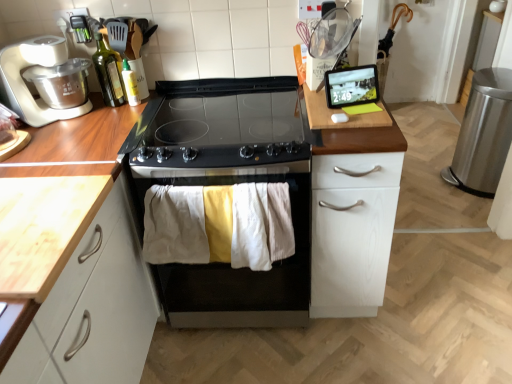
Identify the location of black glass cooktop at center. This screenshot has width=512, height=384. (219, 129).

Where is `white matte food processor at left`? This screenshot has height=384, width=512. white matte food processor at left is located at coordinates (26, 85).

What are the coordinates of `translucent plastic bottle at upper left, marked as the 2th bottle in a left-to-right arrangement` in the screenshot? It's located at (130, 84).

Can you confirm if translucent plastic bottle at upper left, marked as the 2th bottle in a left-to-right arrangement, is positioned to the left of matte black tablet at upper right?

Yes, translucent plastic bottle at upper left, marked as the 2th bottle in a left-to-right arrangement, is to the left of matte black tablet at upper right.

At what (x,y) coordinates should I click in order to perform the action: click on bottle that is the 2nd one when counting backward from the matte black tablet at upper right. Please return your answer as a coordinate pair (x, y). This screenshot has width=512, height=384. Looking at the image, I should click on (130, 84).

Is translucent plastic bottle at upper left, which is the first bottle from right to left, facing towards matte black tablet at upper right?

No, translucent plastic bottle at upper left, which is the first bottle from right to left, does not turn towards matte black tablet at upper right.

Between translucent plastic bottle at upper left, which is the first bottle from right to left, and matte black tablet at upper right, which one is positioned behind?

translucent plastic bottle at upper left, which is the first bottle from right to left, is further away from the camera.

From a real-world perspective, does white matte food processor at left sit lower than light wood countertop at left?

No, from a real-world perspective, white matte food processor at left is not beneath light wood countertop at left.

Consider the image. Is white matte food processor at left looking in the opposite direction of light wood countertop at left?

No, white matte food processor at left is not facing the opposite direction of light wood countertop at left.

Can we say white matte food processor at left lies outside light wood countertop at left?

Yes.

From the picture: Could translucent plastic bottle at upper left, marked as the 2th bottle in a left-to-right arrangement, be considered to be inside white matte food processor at left?

No, translucent plastic bottle at upper left, marked as the 2th bottle in a left-to-right arrangement, is not a part of white matte food processor at left.

Is point (29, 39) farther from camera compared to point (123, 60)?

That is True.

From a real-world perspective, which is physically below, white matte food processor at left or translucent plastic bottle at upper left, marked as the 2th bottle in a left-to-right arrangement?

translucent plastic bottle at upper left, marked as the 2th bottle in a left-to-right arrangement.

In terms of height, does white matte food processor at left look taller or shorter compared to translucent plastic bottle at upper left, which is the first bottle from right to left?

In the image, white matte food processor at left appears to be taller than translucent plastic bottle at upper left, which is the first bottle from right to left.

From the image's perspective, relative to green glass bottle at upper left, the 2th bottle positioned from the right, is black stainless steel oven at center above or below?

black stainless steel oven at center is situated lower than green glass bottle at upper left, the 2th bottle positioned from the right, in the image.

Is black stainless steel oven at center positioned behind green glass bottle at upper left, the 1th bottle in the left-to-right sequence?

No, black stainless steel oven at center is in front of green glass bottle at upper left, the 1th bottle in the left-to-right sequence.

Looking at this image, can you confirm if black stainless steel oven at center is shorter than green glass bottle at upper left, the 2th bottle positioned from the right?

In fact, black stainless steel oven at center may be taller than green glass bottle at upper left, the 2th bottle positioned from the right.

Which object is positioned more to the left, black stainless steel oven at center or green glass bottle at upper left, the 2th bottle positioned from the right?

green glass bottle at upper left, the 2th bottle positioned from the right.

Considering the relative sizes of white matte food processor at left and green glass bottle at upper left, the 1th bottle in the left-to-right sequence, in the image provided, is white matte food processor at left shorter than green glass bottle at upper left, the 1th bottle in the left-to-right sequence,?

Correct, white matte food processor at left is not as tall as green glass bottle at upper left, the 1th bottle in the left-to-right sequence.

From the picture: Considering the positions of objects white matte food processor at left and green glass bottle at upper left, the 2th bottle positioned from the right, in the image provided, who is behind, white matte food processor at left or green glass bottle at upper left, the 2th bottle positioned from the right,?

green glass bottle at upper left, the 2th bottle positioned from the right, is more distant.

Considering the relative positions of white matte food processor at left and green glass bottle at upper left, the 1th bottle in the left-to-right sequence, in the image provided, is white matte food processor at left to the left or to the right of green glass bottle at upper left, the 1th bottle in the left-to-right sequence,?

In the image, white matte food processor at left appears on the left side of green glass bottle at upper left, the 1th bottle in the left-to-right sequence.

What's the angular difference between white matte food processor at left and green glass bottle at upper left, the 1th bottle in the left-to-right sequence,'s facing directions?

white matte food processor at left and green glass bottle at upper left, the 1th bottle in the left-to-right sequence, are facing 81.2 degrees away from each other.

Is white matte cabinet at right next to black stainless steel oven at center and touching it?

No, white matte cabinet at right is not beside black stainless steel oven at center.

Can you confirm if white matte cabinet at right is thinner than black stainless steel oven at center?

Correct, the width of white matte cabinet at right is less than that of black stainless steel oven at center.

From a real-world perspective, is white matte cabinet at right over black stainless steel oven at center?

Yes, from a real-world perspective, white matte cabinet at right is above black stainless steel oven at center.

Which object is positioned more to the left, matte black tablet at upper right or translucent plastic bottle at upper left, marked as the 2th bottle in a left-to-right arrangement?

From the viewer's perspective, translucent plastic bottle at upper left, marked as the 2th bottle in a left-to-right arrangement, appears more on the left side.

You are a GUI agent. You are given a task and a screenshot of the screen. Output one action in this format:
    pyautogui.click(x=<x>, y=<y>)
    Task: Click on the 2nd bottle behind when counting from the matte black tablet at upper right
    The height and width of the screenshot is (384, 512).
    Given the screenshot: What is the action you would take?
    pyautogui.click(x=130, y=84)

Considering the points (362, 85) and (137, 98), which point is in front, point (362, 85) or point (137, 98)?

Point (362, 85)

Which of these two, matte black tablet at upper right or translucent plastic bottle at upper left, which is the first bottle from right to left, is bigger?

matte black tablet at upper right is bigger.

What are the coordinates of `appliance below the translucent plastic bottle at upper left, marked as the 2th bottle in a left-to-right arrangement (from the image's perspective)` in the screenshot? It's located at (351, 86).

You are a GUI agent. You are given a task and a screenshot of the screen. Output one action in this format:
    pyautogui.click(x=<x>, y=<y>)
    Task: Click on the countertop lying in front of the white matte food processor at left
    
    Given the screenshot: What is the action you would take?
    pyautogui.click(x=42, y=228)

Consider the image. Based on their spatial positions, is light wood countertop at left or matte black tablet at upper right closer to white matte cabinet at right?

matte black tablet at upper right.

Considering their positions, is green glass bottle at upper left, the 1th bottle in the left-to-right sequence, positioned further to black glass cooktop at center than black stainless steel oven at center?

green glass bottle at upper left, the 1th bottle in the left-to-right sequence, is further to black glass cooktop at center.

Which object lies further to the anchor point black glass cooktop at center, white matte food processor at left or translucent plastic bottle at upper left, marked as the 2th bottle in a left-to-right arrangement?

white matte food processor at left.

Which object lies further to the anchor point black stainless steel oven at center, matte black tablet at upper right or green glass bottle at upper left, the 1th bottle in the left-to-right sequence?

green glass bottle at upper left, the 1th bottle in the left-to-right sequence.

From the image, which object appears to be nearer to matte black tablet at upper right, black stainless steel oven at center or white matte cabinet at right?

white matte cabinet at right is closer to matte black tablet at upper right.

From the image, which object appears to be farther from green glass bottle at upper left, the 2th bottle positioned from the right, light wood countertop at left or translucent plastic bottle at upper left, which is the first bottle from right to left?

Among the two, light wood countertop at left is located further to green glass bottle at upper left, the 2th bottle positioned from the right.

Based on their spatial positions, is white matte cabinet at right or black stainless steel oven at center further from translucent plastic bottle at upper left, marked as the 2th bottle in a left-to-right arrangement?

white matte cabinet at right lies further to translucent plastic bottle at upper left, marked as the 2th bottle in a left-to-right arrangement, than the other object.

When comparing their distances from black stainless steel oven at center, does white matte food processor at left or light wood countertop at left seem closer?

Based on the image, light wood countertop at left appears to be nearer to black stainless steel oven at center.

You are a GUI agent. You are given a task and a screenshot of the screen. Output one action in this format:
    pyautogui.click(x=<x>, y=<y>)
    Task: Click on the countertop situated between white matte food processor at left and black glass cooktop at center from left to right
    The height and width of the screenshot is (384, 512).
    Given the screenshot: What is the action you would take?
    42,228

This screenshot has width=512, height=384. Identify the location of bottle between white matte food processor at left and translucent plastic bottle at upper left, marked as the 2th bottle in a left-to-right arrangement, in the horizontal direction. (108, 73).

Image resolution: width=512 pixels, height=384 pixels. I want to click on oven between white matte food processor at left and white matte cabinet at right, so click(x=236, y=269).

Identify the location of gas stove between white matte food processor at left and matte black tablet at upper right. (219, 129).